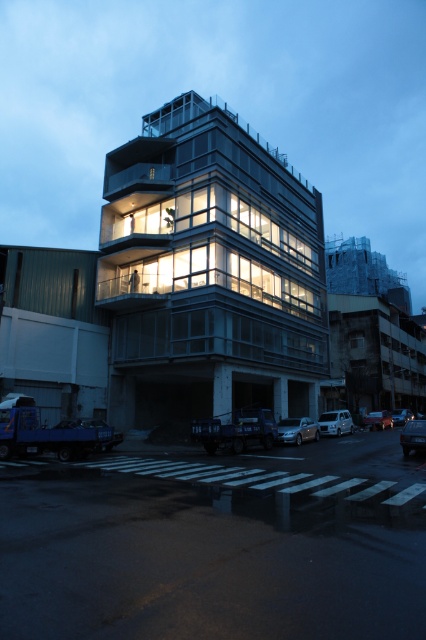
You are a delivery person trying to park your 3.5 meters long truck near the shiny black sedan at center. The transparent glass building at center is blocking part of the parking space. Can you fit your truck there?

The transparent glass building at center is larger than the shiny black sedan at center, but the size comparison does not provide information about the available parking space. Therefore, it is unclear if the truck can fit there.

You are a pedestrian standing on the sidewalk near the pedestrian crossing. You need to cross the street to reach the entrance of the modern multi story building with glass and steel facade. Which car should you avoid stepping on first, the satin silver sedan at center or the shiny black car at lower right?

The satin silver sedan at center is above the shiny black car at lower right, so you should avoid stepping on the satin silver sedan at center first as it is closer to your path.

You are a delivery person who needs to park a new car between the satin silver sedan at center and the shiny black sedan at center. The new car is 1.8 meters wide. Can you fit it there?

The satin silver sedan at center is narrower than the shiny black sedan at center. The distance between them depends on their widths, but since the satin silver sedan at center is narrower, there might be enough space. However, without knowing the exact distance between the cars, it is uncertain if the 1.8 meter wide new car can fit.